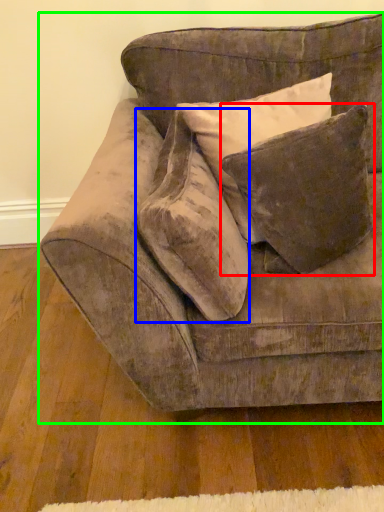
Question: Which object is the closest to the pillow (highlighted by a red box)? Choose among these: throw pillow (highlighted by a blue box) or studio couch (highlighted by a green box).

Choices:
 (A) throw pillow
 (B) studio couch

Answer: (A)